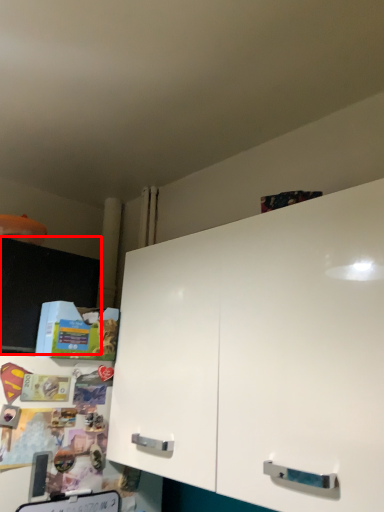
Question: From the image's perspective, where is cabinetry (annotated by the red box) located relative to cabinetry?

Choices:
 (A) above
 (B) below

Answer: (A)